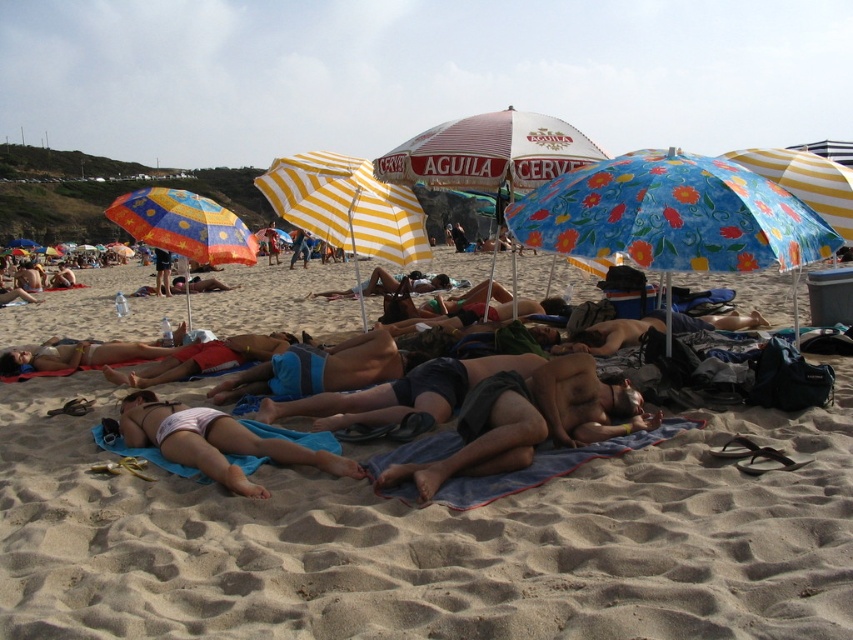
Consider the image. In the beach scene, there are several people relaxing on towels and colorful umbrellas. You notice a point marked at coordinates (527, 420). What object is located at this point?

The point at coordinates (527, 420) marks dark gray shorts at center.